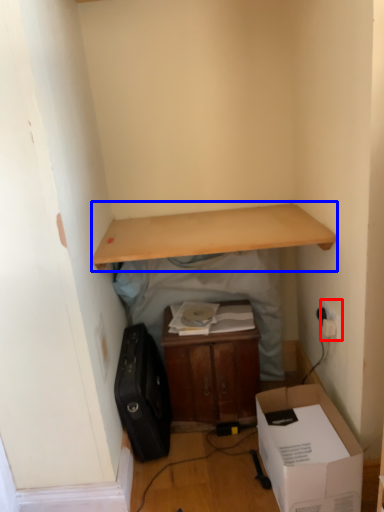
Question: Which of the following is the closest to the observer, electric outlet (highlighted by a red box) or desk (highlighted by a blue box)?

Choices:
 (A) electric outlet
 (B) desk

Answer: (B)